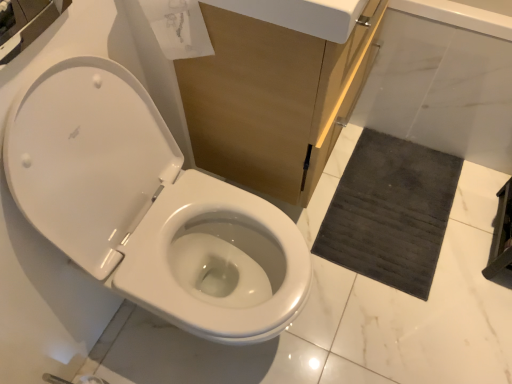
This screenshot has height=384, width=512. What do you see at coordinates (441, 89) in the screenshot? I see `white marble bath at lower right` at bounding box center [441, 89].

Identify the location of white marble bath at lower right. This screenshot has height=384, width=512. (441, 89).

This screenshot has height=384, width=512. What are the coordinates of `transparent paper at upper center` in the screenshot? It's located at (178, 28).

Considering the relative sizes of transparent paper at upper center and dark gray textured bath mat at lower right in the image provided, is transparent paper at upper center bigger than dark gray textured bath mat at lower right?

Correct, transparent paper at upper center is larger in size than dark gray textured bath mat at lower right.

Is transparent paper at upper center in contact with dark gray textured bath mat at lower right?

There is a gap between transparent paper at upper center and dark gray textured bath mat at lower right.

Consider the image. Which is more to the right, transparent paper at upper center or dark gray textured bath mat at lower right?

Positioned to the right is dark gray textured bath mat at lower right.

The width and height of the screenshot is (512, 384). Find the location of `toilet paper in front of the dark gray textured bath mat at lower right`. toilet paper in front of the dark gray textured bath mat at lower right is located at coordinates (178, 28).

Is dark gray textured bath mat at lower right wider than transparent paper at upper center?

Yes.

From the image's perspective, is dark gray textured bath mat at lower right above or below transparent paper at upper center?

dark gray textured bath mat at lower right is below transparent paper at upper center.

From a real-world perspective, is dark gray textured bath mat at lower right located beneath transparent paper at upper center?

Yes, from a real-world perspective, dark gray textured bath mat at lower right is beneath transparent paper at upper center.

Between dark gray textured bath mat at lower right and transparent paper at upper center, which one appears on the right side from the viewer's perspective?

dark gray textured bath mat at lower right.

Which is correct: white glossy toilet at left is inside white marble bath at lower right, or outside of it?

white glossy toilet at left is spatially situated outside white marble bath at lower right.

Is white glossy toilet at left positioned far away from white marble bath at lower right?

No, white glossy toilet at left is in close proximity to white marble bath at lower right.

Considering the sizes of white glossy toilet at left and white marble bath at lower right in the image, is white glossy toilet at left bigger or smaller than white marble bath at lower right?

In the image, white glossy toilet at left appears to be larger than white marble bath at lower right.

How much distance is there between dark gray textured bath mat at lower right and matte wood cabinet at center?

The distance of dark gray textured bath mat at lower right from matte wood cabinet at center is 21.07 inches.

Which of these two, dark gray textured bath mat at lower right or matte wood cabinet at center, is smaller?

With smaller size is dark gray textured bath mat at lower right.

Can you tell me how much dark gray textured bath mat at lower right and matte wood cabinet at center differ in facing direction?

The facing directions of dark gray textured bath mat at lower right and matte wood cabinet at center are 90.7 degrees apart.

Considering the relative positions of dark gray textured bath mat at lower right and matte wood cabinet at center in the image provided, is dark gray textured bath mat at lower right to the left of matte wood cabinet at center from the viewer's perspective?

Incorrect, dark gray textured bath mat at lower right is not on the left side of matte wood cabinet at center.

How much distance is there between dark gray textured bath mat at lower right and white marble bath at lower right?

The distance of dark gray textured bath mat at lower right from white marble bath at lower right is 11.11 inches.

Can you confirm if dark gray textured bath mat at lower right is positioned to the left of white marble bath at lower right?

Yes, dark gray textured bath mat at lower right is to the left of white marble bath at lower right.

From the image's perspective, is dark gray textured bath mat at lower right located above or below white marble bath at lower right?

Clearly, from the image's perspective, dark gray textured bath mat at lower right is below white marble bath at lower right.

Is dark gray textured bath mat at lower right positioned with its back to white marble bath at lower right?

dark gray textured bath mat at lower right does not have its back to white marble bath at lower right.

Considering the relative positions of transparent paper at upper center and matte wood cabinet at center in the image provided, is transparent paper at upper center to the right of matte wood cabinet at center from the viewer's perspective?

No.

Is the surface of transparent paper at upper center in direct contact with matte wood cabinet at center?

transparent paper at upper center is not next to matte wood cabinet at center, and they're not touching.

Consider the image. Which of these two, transparent paper at upper center or matte wood cabinet at center, is smaller?

Smaller between the two is transparent paper at upper center.

Which object is closer to the camera, transparent paper at upper center or matte wood cabinet at center?

transparent paper at upper center is closer to the camera.

Would you say dark gray textured bath mat at lower right is part of matte wood cabinet at center's contents?

No, dark gray textured bath mat at lower right is not inside matte wood cabinet at center.

Is matte wood cabinet at center turned away from dark gray textured bath mat at lower right?

That's not correct — matte wood cabinet at center is not looking away from dark gray textured bath mat at lower right.

Is matte wood cabinet at center bigger or smaller than dark gray textured bath mat at lower right?

matte wood cabinet at center is bigger than dark gray textured bath mat at lower right.

At what (x,y) coordinates should I click in order to perform the action: click on toilet paper in front of the dark gray textured bath mat at lower right. Please return your answer as a coordinate pair (x, y). This screenshot has height=384, width=512. Looking at the image, I should click on (178, 28).

The image size is (512, 384). In the image, there is a dark gray textured bath mat at lower right. Find the location of `toilet paper above it (from the image's perspective)`. toilet paper above it (from the image's perspective) is located at coordinates (178, 28).

Looking at this image, based on their spatial positions, is matte wood cabinet at center or white glossy toilet at left closer to transparent paper at upper center?

matte wood cabinet at center is closer to transparent paper at upper center.

From the image, which object appears to be farther from white marble bath at lower right, transparent paper at upper center or dark gray textured bath mat at lower right?

transparent paper at upper center is positioned further to the anchor white marble bath at lower right.

Looking at this image, when comparing their distances from dark gray textured bath mat at lower right, does white glossy toilet at left or matte wood cabinet at center seem closer?

matte wood cabinet at center is closer to dark gray textured bath mat at lower right.

From the picture: Looking at the image, which one is located further to matte wood cabinet at center, white glossy toilet at left or dark gray textured bath mat at lower right?

Among the two, dark gray textured bath mat at lower right is located further to matte wood cabinet at center.

Which object lies further to the anchor point white glossy toilet at left, dark gray textured bath mat at lower right or transparent paper at upper center?

dark gray textured bath mat at lower right is positioned further to the anchor white glossy toilet at left.

From the image, which object appears to be nearer to white glossy toilet at left, matte wood cabinet at center or transparent paper at upper center?

Based on the image, matte wood cabinet at center appears to be nearer to white glossy toilet at left.

When comparing their distances from transparent paper at upper center, does white glossy toilet at left or white marble bath at lower right seem closer?

white glossy toilet at left is closer to transparent paper at upper center.

Considering their positions, is white marble bath at lower right positioned closer to matte wood cabinet at center than dark gray textured bath mat at lower right?

Based on the image, white marble bath at lower right appears to be nearer to matte wood cabinet at center.

Find the location of a particular element. cabinetry between transparent paper at upper center and white marble bath at lower right in the horizontal direction is located at coordinates (273, 99).

Where is `cabinetry situated between white glossy toilet at left and white marble bath at lower right from left to right`? The width and height of the screenshot is (512, 384). cabinetry situated between white glossy toilet at left and white marble bath at lower right from left to right is located at coordinates (273, 99).

The height and width of the screenshot is (384, 512). I want to click on bath between matte wood cabinet at center and dark gray textured bath mat at lower right along the z-axis, so click(x=441, y=89).

You are a GUI agent. You are given a task and a screenshot of the screen. Output one action in this format:
    pyautogui.click(x=<x>, y=<y>)
    Task: Click on the bath positioned between white glossy toilet at left and dark gray textured bath mat at lower right from near to far
    The image size is (512, 384).
    Given the screenshot: What is the action you would take?
    pyautogui.click(x=441, y=89)